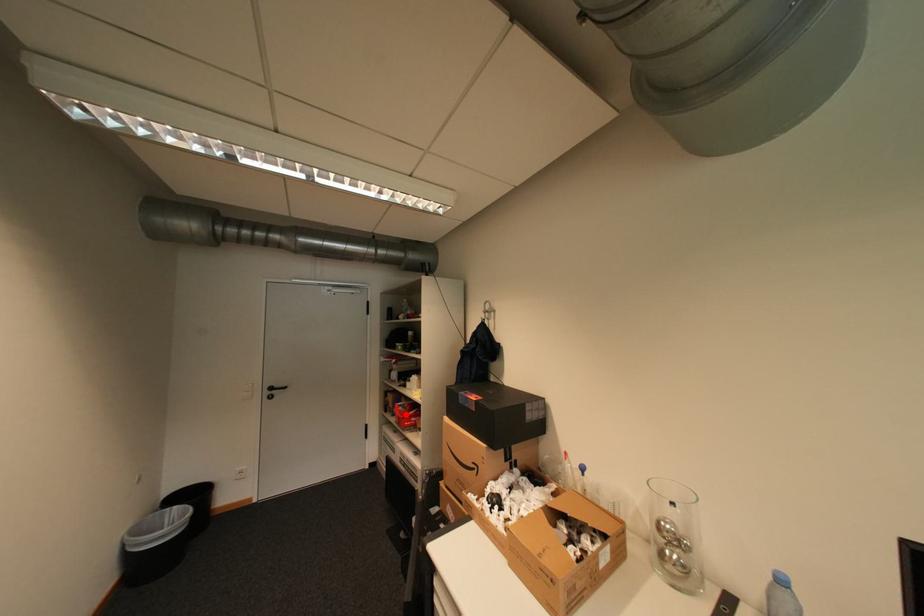
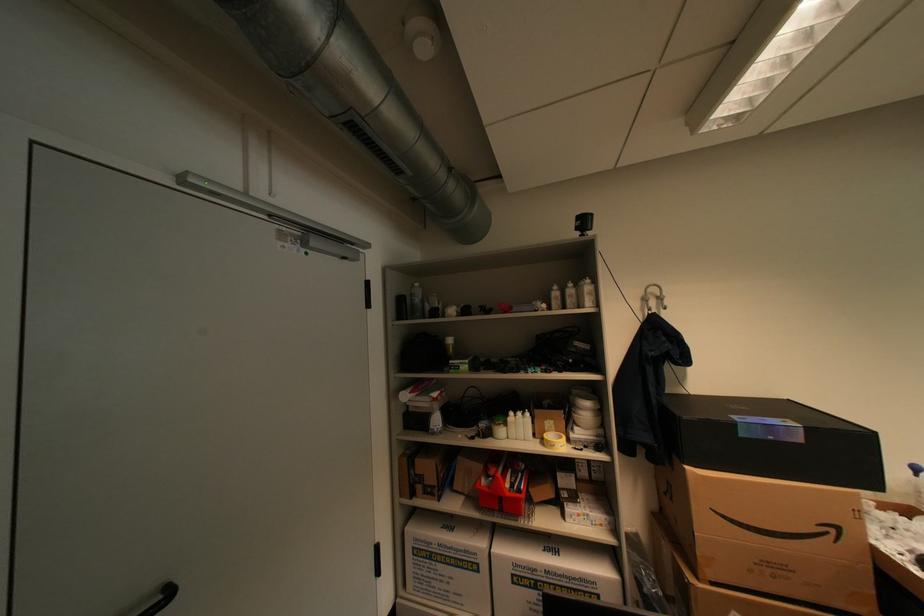
Question: I am providing you with two images of the same scene from different viewpoints. Given a red point in image1, look at the same physical point in image2. Is it:

Choices:
 (A) Closer to the viewpoint
 (B) Farther from the viewpoint

Answer: (A)